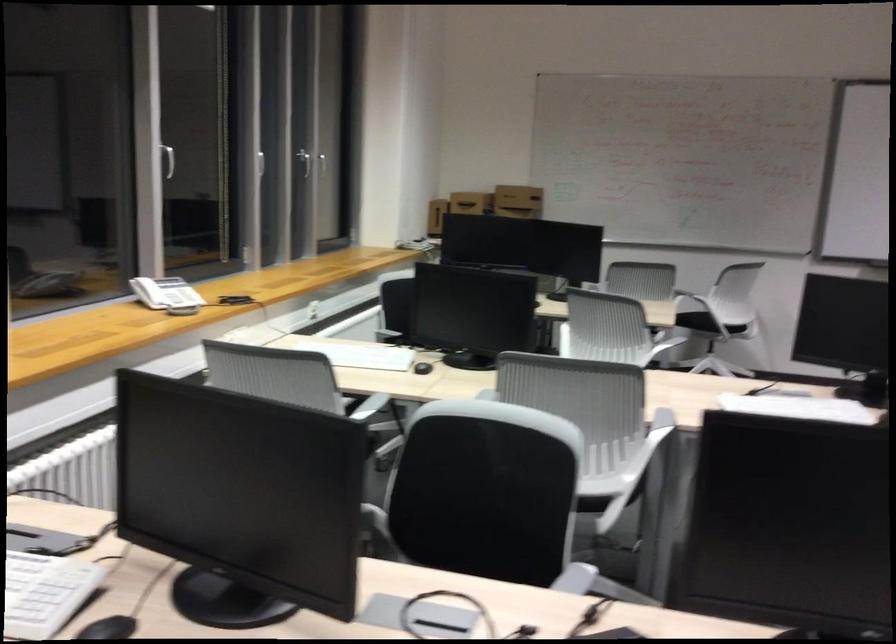
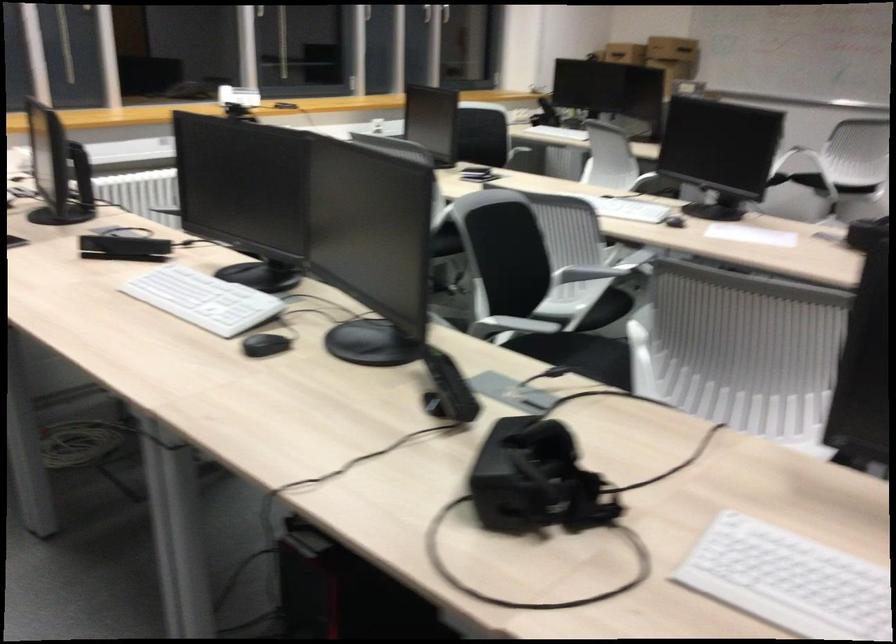
Where in the second image is the point corresponding to (x=631, y=476) from the first image?

(445, 242)